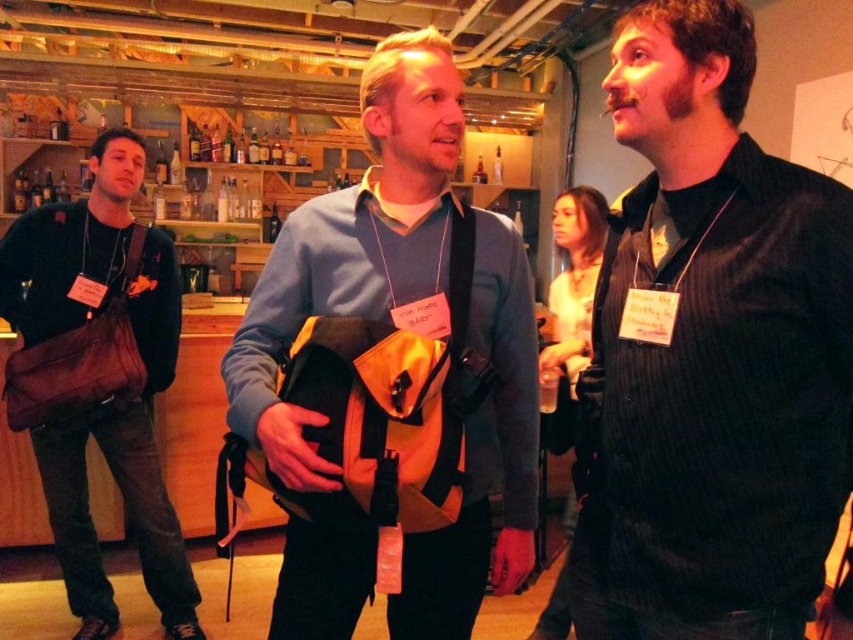
Can you confirm if yellow fabric backpack at center is taller than brown canvas bag at left?

No, yellow fabric backpack at center is not taller than brown canvas bag at left.

Can you confirm if yellow fabric backpack at center is thinner than brown canvas bag at left?

Yes, yellow fabric backpack at center is thinner than brown canvas bag at left.

Is point (374, 74) positioned after point (107, 337)?

No, it is not.

Locate an element on the screen. yellow fabric backpack at center is located at coordinates (403, 321).

Does point (701, 145) come behind point (47, 256)?

No, (701, 145) is in front of (47, 256).

Is black pinstripe shirt at center positioned at the back of brown canvas bag at left?

No.

Find the location of a particular element. black pinstripe shirt at center is located at coordinates (711, 355).

Can you confirm if black pinstripe shirt at center is taller than yellow fabric backpack at center?

No.

Describe the element at coordinates (711, 355) in the screenshot. The height and width of the screenshot is (640, 853). I see `black pinstripe shirt at center` at that location.

I want to click on black pinstripe shirt at center, so click(x=711, y=355).